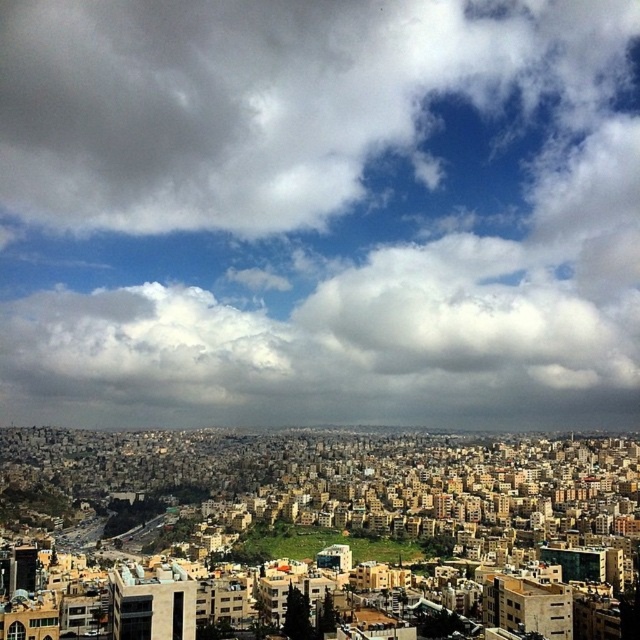
Question: Which of the following is the farthest from the observer?

Choices:
 (A) green grassy hill at center
 (B) cloudy sky at upper center

Answer: (B)

Question: Which of the following is the closest to the observer?

Choices:
 (A) (244, 58)
 (B) (358, 538)

Answer: (B)

Question: Is cloudy sky at upper center below green grassy hill at center?

Choices:
 (A) no
 (B) yes

Answer: (A)

Question: Which object is closer to the camera taking this photo?

Choices:
 (A) green grassy hill at center
 (B) cloudy sky at upper center

Answer: (A)

Question: Is cloudy sky at upper center smaller than green grassy hill at center?

Choices:
 (A) no
 (B) yes

Answer: (A)

Question: Is cloudy sky at upper center wider than green grassy hill at center?

Choices:
 (A) yes
 (B) no

Answer: (A)